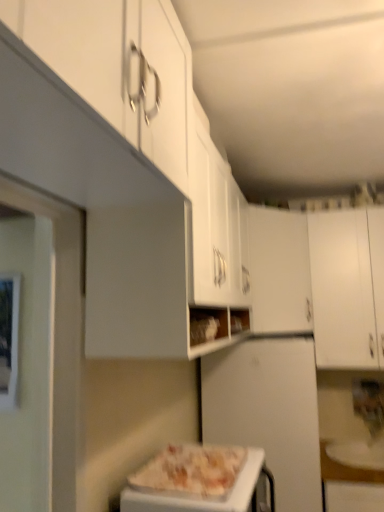
Question: Does white matte refrigerator at center turn towards white matte cabinet at right, the first cabinetry viewed from the right?

Choices:
 (A) no
 (B) yes

Answer: (A)

Question: Is white matte refrigerator at center placed right next to white matte cabinet at right, the second cabinetry from the left?

Choices:
 (A) no
 (B) yes

Answer: (A)

Question: From a real-world perspective, is white matte refrigerator at center over white matte cabinet at right, the first cabinetry viewed from the right?

Choices:
 (A) yes
 (B) no

Answer: (B)

Question: Would you consider white matte refrigerator at center to be distant from white matte cabinet at right, the first cabinetry viewed from the right?

Choices:
 (A) yes
 (B) no

Answer: (B)

Question: Considering the relative sizes of white matte refrigerator at center and white matte cabinet at right, the first cabinetry viewed from the right, in the image provided, is white matte refrigerator at center shorter than white matte cabinet at right, the first cabinetry viewed from the right,?

Choices:
 (A) no
 (B) yes

Answer: (A)

Question: Is white matte refrigerator at center oriented away from white matte cabinet at right, the second cabinetry from the left?

Choices:
 (A) yes
 (B) no

Answer: (B)

Question: Considering the relative sizes of white matte cabinet at center, arranged as the first cabinetry when viewed from the left, and white glossy plate at lower right in the image provided, is white matte cabinet at center, arranged as the first cabinetry when viewed from the left, shorter than white glossy plate at lower right?

Choices:
 (A) yes
 (B) no

Answer: (B)

Question: Would you say white matte cabinet at center, acting as the second cabinetry starting from the right, is outside white glossy plate at lower right?

Choices:
 (A) no
 (B) yes

Answer: (B)

Question: Is white matte cabinet at center, acting as the second cabinetry starting from the right, at the right side of white glossy plate at lower right?

Choices:
 (A) no
 (B) yes

Answer: (A)

Question: Is the depth of white matte cabinet at center, arranged as the first cabinetry when viewed from the left, greater than that of white glossy plate at lower right?

Choices:
 (A) no
 (B) yes

Answer: (B)

Question: From a real-world perspective, is white matte cabinet at center, acting as the second cabinetry starting from the right, on white glossy plate at lower right?

Choices:
 (A) no
 (B) yes

Answer: (B)

Question: From a real-world perspective, is white matte cabinet at center, arranged as the first cabinetry when viewed from the left, below white glossy plate at lower right?

Choices:
 (A) yes
 (B) no

Answer: (B)

Question: Could you tell me if white glossy plate at lower right is turned towards white matte cabinet at right, the second cabinetry from the left?

Choices:
 (A) no
 (B) yes

Answer: (A)